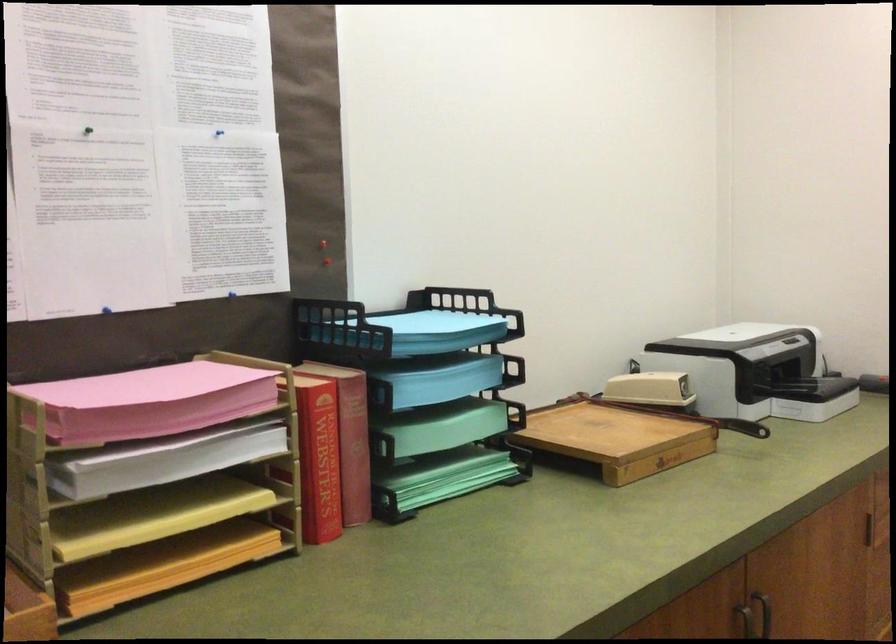
Describe the element at coordinates (746, 336) in the screenshot. I see `a white printer lid` at that location.